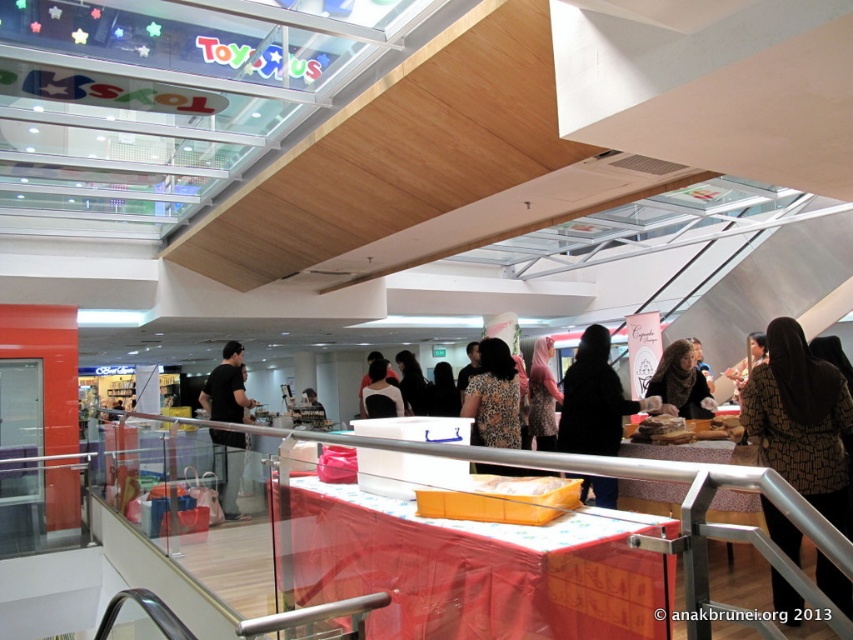
Question: Is matte brown scarf at center in front of black matte shirt at center?

Choices:
 (A) yes
 (B) no

Answer: (A)

Question: Among these objects, which one is nearest to the camera?

Choices:
 (A) matte brown scarf at center
 (B) brown printed dress at center

Answer: (B)

Question: Among these points, which one is farthest from the camera?

Choices:
 (A) (247, 404)
 (B) (552, 394)
 (C) (451, 401)

Answer: (C)

Question: Is patterned fabric hijab at center to the right of matte black hair at center from the viewer's perspective?

Choices:
 (A) yes
 (B) no

Answer: (A)

Question: Is black fabric at center below matte brown scarf at center?

Choices:
 (A) yes
 (B) no

Answer: (A)

Question: Among these points, which one is nearest to the camera?

Choices:
 (A) (616, 440)
 (B) (479, 408)

Answer: (A)